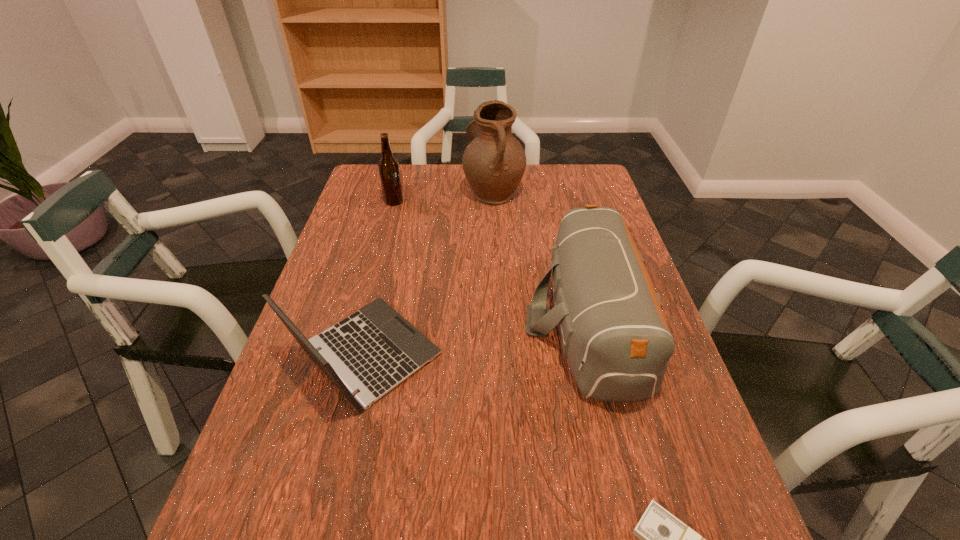
The image size is (960, 540). I want to click on pitcher at the far edge, so [494, 162].

Where is `beer bottle located in the far edge section of the desktop`? The height and width of the screenshot is (540, 960). beer bottle located in the far edge section of the desktop is located at coordinates (389, 171).

You are a GUI agent. You are given a task and a screenshot of the screen. Output one action in this format:
    pyautogui.click(x=<x>, y=<y>)
    Task: Click on the beer bottle located in the left edge section of the desktop
    The height and width of the screenshot is (540, 960).
    Given the screenshot: What is the action you would take?
    pyautogui.click(x=389, y=171)

Locate an element on the screen. Image resolution: width=960 pixels, height=540 pixels. laptop_computer located in the left edge section of the desktop is located at coordinates (373, 350).

You are a GUI agent. You are given a task and a screenshot of the screen. Output one action in this format:
    pyautogui.click(x=<x>, y=<y>)
    Task: Click on the object at the right edge
    The image size is (960, 540).
    Given the screenshot: What is the action you would take?
    pos(614,334)

At what (x,y) coordinates should I click in order to perform the action: click on object located at the far left corner. Please return your answer as a coordinate pair (x, y). This screenshot has height=540, width=960. Looking at the image, I should click on (389, 171).

The width and height of the screenshot is (960, 540). In the image, there is a desktop. In order to click on vacant space at the far edge in this screenshot , I will do `click(424, 176)`.

In the image, there is a desktop. Identify the location of free region at the left edge. (237, 484).

At what (x,y) coordinates should I click in order to perform the action: click on vacant space at the right edge. Please return your answer as a coordinate pair (x, y). Image resolution: width=960 pixels, height=540 pixels. Looking at the image, I should click on (691, 526).

The width and height of the screenshot is (960, 540). What are the coordinates of `vacant space at the far left corner of the desktop` in the screenshot? It's located at (358, 187).